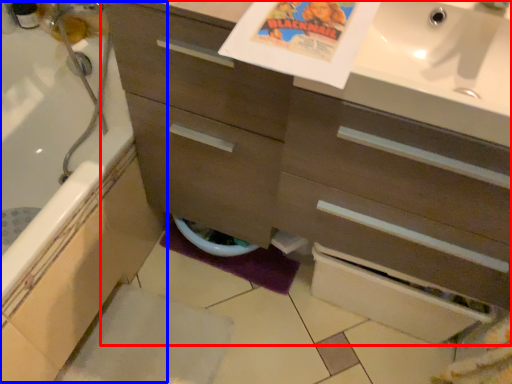
Question: Which of the following is the closest to the observer, bathroom cabinet (highlighted by a red box) or bath (highlighted by a blue box)?

Choices:
 (A) bathroom cabinet
 (B) bath

Answer: (A)